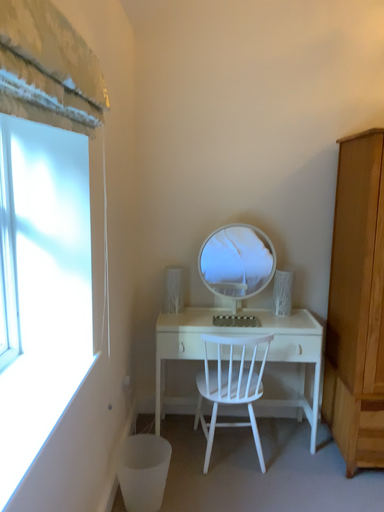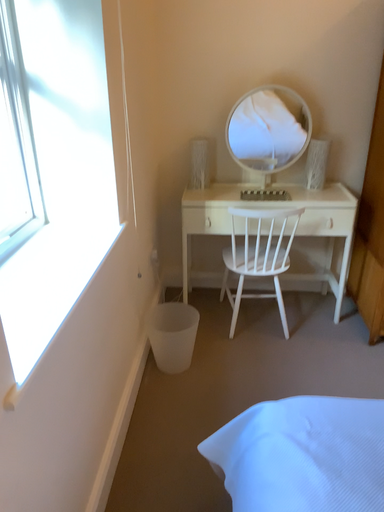
Question: Which way did the camera rotate in the video?

Choices:
 (A) rotated downward
 (B) rotated upward

Answer: (A)